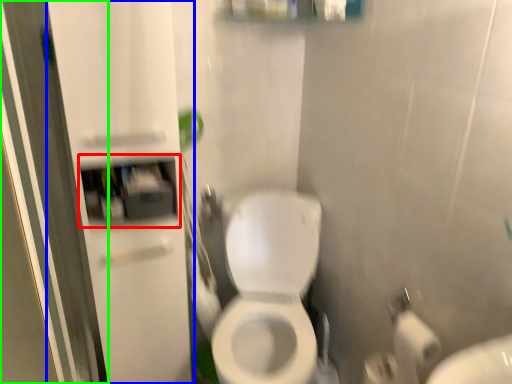
Question: Which is nearer to the medicine cabinet (highlighted by a red box)? screen door (highlighted by a blue box) or screen door (highlighted by a green box).

Choices:
 (A) screen door
 (B) screen door

Answer: (A)